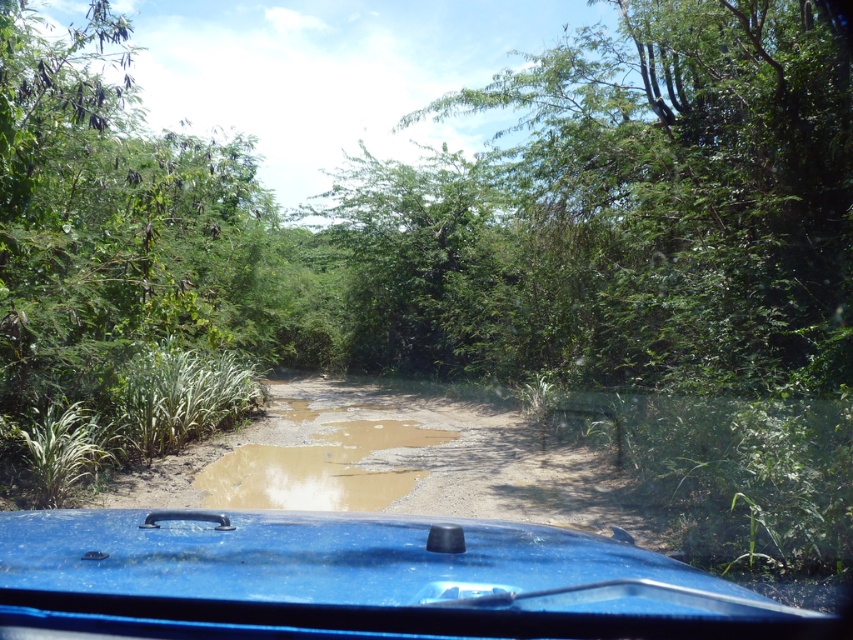
Measure the distance from glossy blue car at center to brown muddy puddle at center.

glossy blue car at center is 6.28 meters away from brown muddy puddle at center.

Can you confirm if glossy blue car at center is positioned to the left of brown muddy puddle at center?

No, glossy blue car at center is not to the left of brown muddy puddle at center.

Who is more distant from viewer, [354,584] or [224,468]?

The point [224,468] is more distant.

At what (x,y) coordinates should I click in order to perform the action: click on glossy blue car at center. Please return your answer as a coordinate pair (x, y). Image resolution: width=853 pixels, height=640 pixels. Looking at the image, I should click on (355, 579).